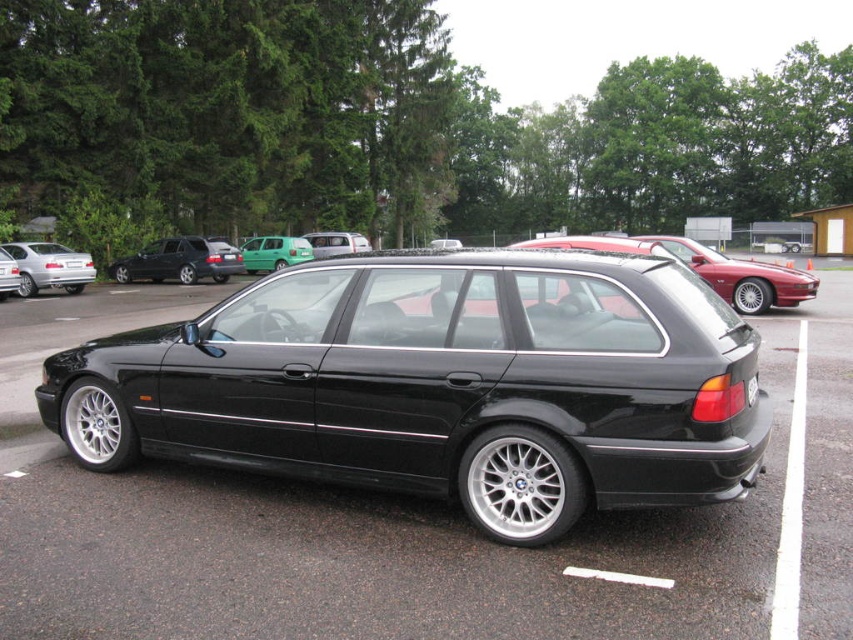
This screenshot has width=853, height=640. I want to click on silver metallic sedan at left, so click(50, 266).

Does silver metallic sedan at left come in front of green matte hatchback at center?

Yes, silver metallic sedan at left is in front of green matte hatchback at center.

This screenshot has height=640, width=853. Describe the element at coordinates (50, 266) in the screenshot. I see `silver metallic sedan at left` at that location.

Locate an element on the screen. The height and width of the screenshot is (640, 853). silver metallic sedan at left is located at coordinates (50, 266).

Between metallic red car at upper right and black plastic license plate at rear, which one is positioned lower?

Positioned lower is black plastic license plate at rear.

Locate an element on the screen. The width and height of the screenshot is (853, 640). metallic red car at upper right is located at coordinates (706, 268).

Where is `metallic red car at upper right`? The image size is (853, 640). metallic red car at upper right is located at coordinates (706, 268).

The height and width of the screenshot is (640, 853). I want to click on metallic red car at upper right, so click(x=706, y=268).

The image size is (853, 640). Describe the element at coordinates (440, 385) in the screenshot. I see `black metallic car at center` at that location.

Which is behind, point (68, 387) or point (752, 388)?

The point (68, 387) is more distant.

At what (x,y) coordinates should I click in order to perform the action: click on black metallic car at center. Please return your answer as a coordinate pair (x, y). This screenshot has height=640, width=853. Looking at the image, I should click on (440, 385).